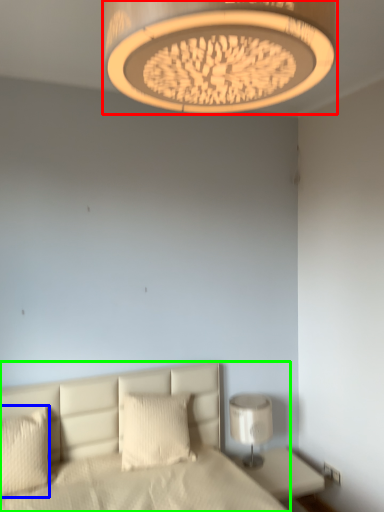
Question: Which object is the farthest from lamp (highlighted by a red box)? Choose among these: pillow (highlighted by a blue box) or bed (highlighted by a green box).

Choices:
 (A) pillow
 (B) bed

Answer: (A)